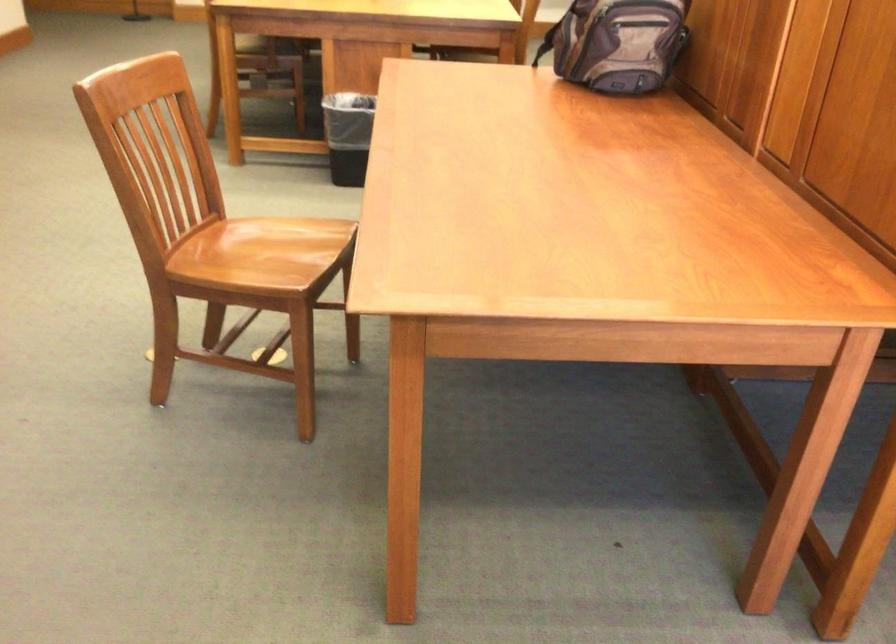
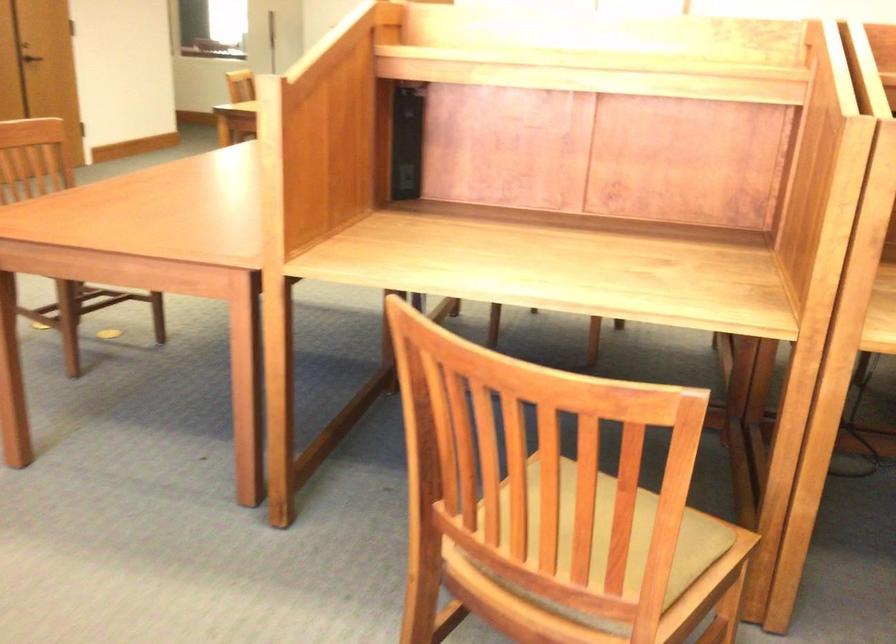
Question: I am providing you with two images of the same scene from different viewpoints. After the viewpoint changes to image2, which objects are now occluded?

Choices:
 (A) metal door handle
 (B) chair sitting surface
 (C) clear plastic container
 (D) backpack handle

Answer: (D)